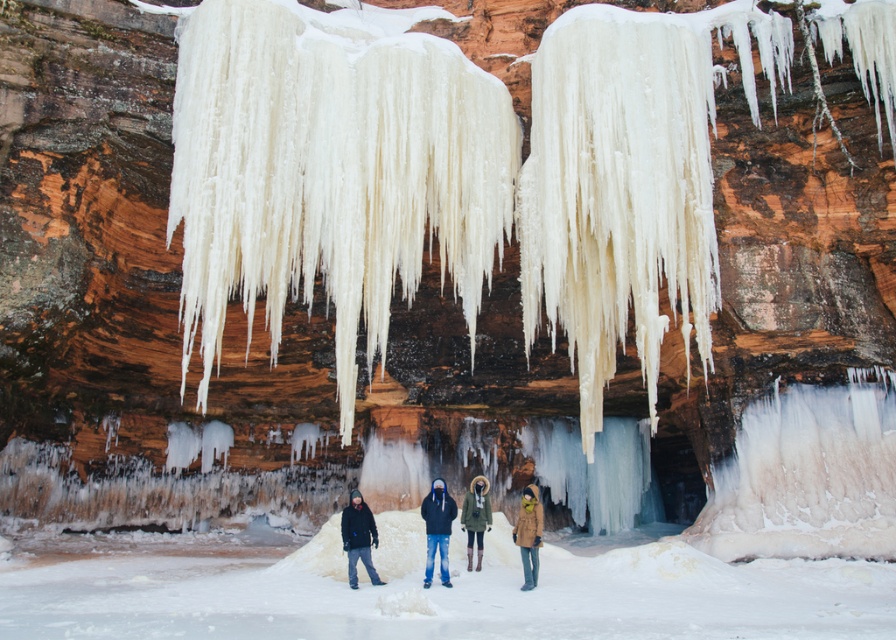
At what (x,y) coordinates should I click in order to perform the action: click on black matte jacket at center. Please return your answer as a coordinate pair (x, y). Looking at the image, I should click on (437, 529).

Does point (433, 531) lie behind point (369, 547)?

That is True.

Locate an element on the screen. black matte jacket at center is located at coordinates (437, 529).

Is black matte jacket at lower left to the left of tan leather coat at center from the viewer's perspective?

Indeed, black matte jacket at lower left is positioned on the left side of tan leather coat at center.

Can you confirm if black matte jacket at lower left is wider than tan leather coat at center?

Yes, black matte jacket at lower left is wider than tan leather coat at center.

The image size is (896, 640). I want to click on black matte jacket at lower left, so click(x=358, y=538).

Can you confirm if dark blue jacket at center is shorter than olive-green wool coat at center?

A: Incorrect, dark blue jacket at center's height does not fall short of olive-green wool coat at center's.

From the picture: Does dark blue jacket at center appear on the right side of olive-green wool coat at center?

No, dark blue jacket at center is not to the right of olive-green wool coat at center.

Find the location of a particular element. The image size is (896, 640). dark blue jacket at center is located at coordinates (445, 536).